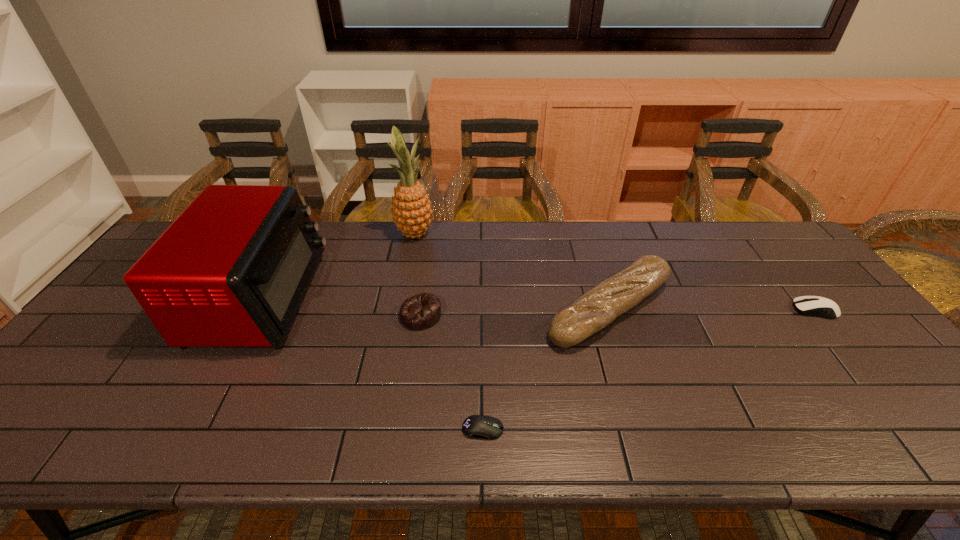
Where is `free space between the farthest object and the fourth tallest object`? This screenshot has height=540, width=960. free space between the farthest object and the fourth tallest object is located at coordinates (418, 275).

Locate an element on the screen. The image size is (960, 540). free space between the baguet and the taller computer equipment is located at coordinates (712, 309).

Find the location of a particular element. vacant space in between the nearer computer equipment and the toaster oven is located at coordinates (372, 363).

Where is `empty space that is in between the beanbag and the baguet`? The image size is (960, 540). empty space that is in between the beanbag and the baguet is located at coordinates (516, 312).

Where is `object that stands as the second closest to the farther computer equipment`? Image resolution: width=960 pixels, height=540 pixels. object that stands as the second closest to the farther computer equipment is located at coordinates (475, 426).

Where is `the third closest object to the rightmost object`? This screenshot has width=960, height=540. the third closest object to the rightmost object is located at coordinates pyautogui.click(x=422, y=311).

Find the location of a particular element. The width and height of the screenshot is (960, 540). vacant region that satisfies the following two spatial constraints: 1. on the front-facing side of the baguet; 2. on the right side of the toaster oven is located at coordinates (256, 309).